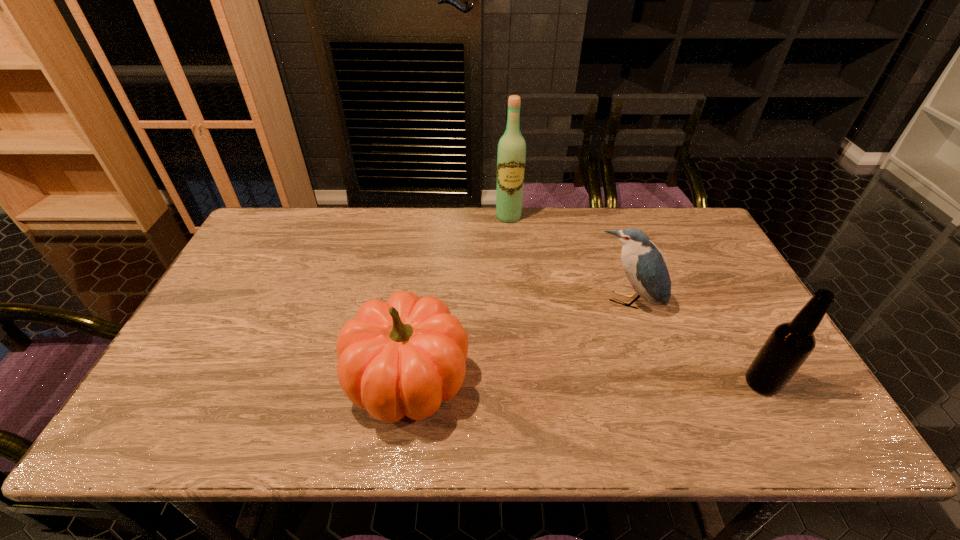
Locate an element on the screen. The height and width of the screenshot is (540, 960). free space that is in between the second farthest object and the leftmost object is located at coordinates (517, 341).

The height and width of the screenshot is (540, 960). What are the coordinates of `free space between the farthest object and the pumpkin` in the screenshot? It's located at (458, 298).

Identify which object is located as the nearest to the rightmost object. Please provide its 2D coordinates. Your answer should be formatted as a tuple, i.e. [(x, y)], where the tuple contains the x and y coordinates of a point satisfying the conditions above.

[(644, 266)]

Identify which object is located as the second nearest to the farthest object. Please provide its 2D coordinates. Your answer should be formatted as a tuple, i.e. [(x, y)], where the tuple contains the x and y coordinates of a point satisfying the conditions above.

[(403, 357)]

You are a GUI agent. You are given a task and a screenshot of the screen. Output one action in this format:
    pyautogui.click(x=<x>, y=<y>)
    Task: Click on the free space that satisfies the following two spatial constraints: 1. on the front side of the farthest object; 2. on the right side of the beer bottle
    Image resolution: width=960 pixels, height=540 pixels.
    Given the screenshot: What is the action you would take?
    pyautogui.click(x=522, y=383)

Identify the location of vacant point that satisfies the following two spatial constraints: 1. on the back side of the second object from right to left; 2. on the right side of the pumpkin. (419, 303).

The image size is (960, 540). Identify the location of free space that satisfies the following two spatial constraints: 1. on the front side of the bird; 2. on the left side of the tallest object. (516, 303).

The height and width of the screenshot is (540, 960). In order to click on free location that satisfies the following two spatial constraints: 1. on the front side of the farthest object; 2. on the right side of the rightmost object in this screenshot , I will do `click(522, 383)`.